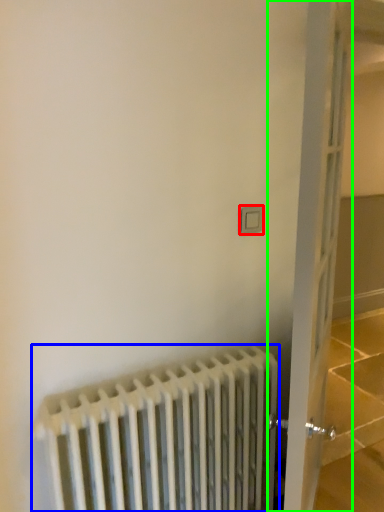
Question: Estimate the real-world distances between objects in this image. Which object is closer to electric outlet (highlighted by a red box), radiator (highlighted by a blue box) or door (highlighted by a green box)?

Choices:
 (A) radiator
 (B) door

Answer: (B)